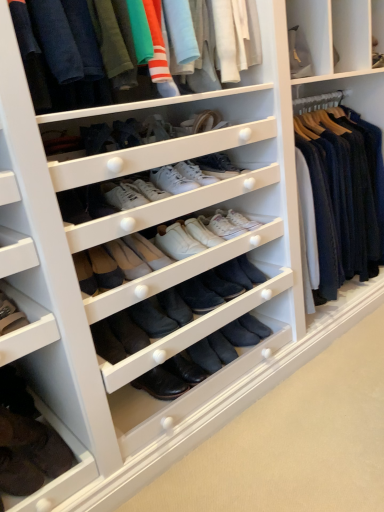
What are the coordinates of `matte cotton t-shirts at upper center` in the screenshot? It's located at (97, 45).

Measure the distance between black suede boot at center, positioned as the fourth shoe in top-to-bottom order, and camera.

They are 1.73 meters apart.

Describe the element at coordinates (222, 347) in the screenshot. This screenshot has height=512, width=384. I see `black suede boot at center, the second shoe from the bottom` at that location.

In order to click on white leather sneakers at center, which is the first shoe in top-to-bottom order in this screenshot , I will do `click(195, 173)`.

Identify the location of leather boot at lower left, which is the second footwear from bottom to top. (10, 315).

Locate an element on the screen. brown leather boots at lower left, the second footwear when ordered from top to bottom is located at coordinates tap(26, 441).

From a real-world perspective, is leather boot at lower left, the 1th footwear when ordered from top to bottom, under matte black boots at center?

No, from a real-world perspective, leather boot at lower left, the 1th footwear when ordered from top to bottom, is not under matte black boots at center.

Considering the positions of objects leather boot at lower left, the 1th footwear when ordered from top to bottom, and matte black boots at center in the image provided, who is in front, leather boot at lower left, the 1th footwear when ordered from top to bottom, or matte black boots at center?

matte black boots at center is in front.

Choose the correct answer: Is leather boot at lower left, which is the second footwear from bottom to top, inside matte black boots at center or outside it?

leather boot at lower left, which is the second footwear from bottom to top, is located beyond the bounds of matte black boots at center.

This screenshot has width=384, height=512. I want to click on drawer below the leather boot at lower left, which is the second footwear from bottom to top (from the image's perspective), so click(x=181, y=351).

Which object is thinner, white leather sneakers at center, the 3th shoe viewed from the top, or matte cotton t-shirts at upper center?

With smaller width is white leather sneakers at center, the 3th shoe viewed from the top.

From the image's perspective, is white leather sneakers at center, the third shoe when ordered from bottom to top, under matte cotton t-shirts at upper center?

Correct, white leather sneakers at center, the third shoe when ordered from bottom to top, appears lower than matte cotton t-shirts at upper center in the image.

Based on the photo, how distant is white leather sneakers at center, the 3th shoe viewed from the top, from matte cotton t-shirts at upper center?

white leather sneakers at center, the 3th shoe viewed from the top, and matte cotton t-shirts at upper center are 18.23 inches apart from each other.

Considering the sizes of objects white leather sneakers at center, which ranks as the second shoe in top-to-bottom order, and brown leather boots at lower left, the second footwear when ordered from top to bottom, in the image provided, who is smaller, white leather sneakers at center, which ranks as the second shoe in top-to-bottom order, or brown leather boots at lower left, the second footwear when ordered from top to bottom,?

white leather sneakers at center, which ranks as the second shoe in top-to-bottom order, is smaller.

From a real-world perspective, is white leather sneakers at center, which ranks as the second shoe in top-to-bottom order, physically below brown leather boots at lower left, the second footwear when ordered from top to bottom?

Incorrect, from a real-world perspective, white leather sneakers at center, which ranks as the second shoe in top-to-bottom order, is higher than brown leather boots at lower left, the second footwear when ordered from top to bottom.

Which is more to the left, white leather sneakers at center, which ranks as the 4th shoe in bottom-to-top order, or brown leather boots at lower left, the first footwear when ordered from bottom to top?

From the viewer's perspective, brown leather boots at lower left, the first footwear when ordered from bottom to top, appears more on the left side.

Is matte black boots at center directly adjacent to white leather sneakers at center, the 3th shoe viewed from the top?

No, matte black boots at center is not beside white leather sneakers at center, the 3th shoe viewed from the top.

From a real-world perspective, which is physically above, matte black boots at center or white leather sneakers at center, the 3th shoe viewed from the top?

white leather sneakers at center, the 3th shoe viewed from the top.

Does matte black boots at center lie in front of white leather sneakers at center, the third shoe when ordered from bottom to top?

Yes, matte black boots at center is closer to the viewer.

Is brown leather boots at lower left, the second footwear when ordered from top to bottom, further to the viewer compared to leather boot at lower left, the 1th footwear when ordered from top to bottom?

No.

Visually, is brown leather boots at lower left, the first footwear when ordered from bottom to top, positioned to the left or to the right of leather boot at lower left, the 1th footwear when ordered from top to bottom?

In the image, brown leather boots at lower left, the first footwear when ordered from bottom to top, appears on the left side of leather boot at lower left, the 1th footwear when ordered from top to bottom.

Considering the sizes of objects brown leather boots at lower left, the second footwear when ordered from top to bottom, and leather boot at lower left, which is the second footwear from bottom to top, in the image provided, who is bigger, brown leather boots at lower left, the second footwear when ordered from top to bottom, or leather boot at lower left, which is the second footwear from bottom to top,?

brown leather boots at lower left, the second footwear when ordered from top to bottom, is bigger.

Which is correct: brown leather boots at lower left, the first footwear when ordered from bottom to top, is inside leather boot at lower left, the 1th footwear when ordered from top to bottom, or outside of it?

brown leather boots at lower left, the first footwear when ordered from bottom to top, cannot be found inside leather boot at lower left, the 1th footwear when ordered from top to bottom.

Based on their sizes in the image, would you say matte cotton t-shirts at upper center is bigger or smaller than brown leather boots at lower left, the second footwear when ordered from top to bottom?

Clearly, matte cotton t-shirts at upper center is larger in size than brown leather boots at lower left, the second footwear when ordered from top to bottom.

From the image's perspective, is matte cotton t-shirts at upper center on top of brown leather boots at lower left, the second footwear when ordered from top to bottom?

Yes.

Does matte cotton t-shirts at upper center come behind brown leather boots at lower left, the second footwear when ordered from top to bottom?

No, it is in front of brown leather boots at lower left, the second footwear when ordered from top to bottom.

Is leather boot at lower left, the 1th footwear when ordered from top to bottom, to the left of white leather sneakers at center, the fifth shoe when ordered from bottom to top, from the viewer's perspective?

Yes.

Is leather boot at lower left, the 1th footwear when ordered from top to bottom, wider or thinner than white leather sneakers at center, which is the first shoe in top-to-bottom order?

In the image, leather boot at lower left, the 1th footwear when ordered from top to bottom, appears to be more narrow than white leather sneakers at center, which is the first shoe in top-to-bottom order.

Considering the sizes of objects leather boot at lower left, the 1th footwear when ordered from top to bottom, and white leather sneakers at center, which is the first shoe in top-to-bottom order, in the image provided, who is smaller, leather boot at lower left, the 1th footwear when ordered from top to bottom, or white leather sneakers at center, which is the first shoe in top-to-bottom order,?

white leather sneakers at center, which is the first shoe in top-to-bottom order, is smaller.

Which is farther, [25,319] or [179,165]?

Point [179,165]

Locate an element on the screen. The height and width of the screenshot is (512, 384). the 2nd footwear positioned above the matte black boots at center (from a real-world perspective) is located at coordinates (10, 315).

This screenshot has width=384, height=512. What are the coordinates of `clothing on the right side of white leather sneakers at center, the third shoe when ordered from bottom to top` in the screenshot? It's located at (97, 45).

Looking at the image, which one is located further to black leather boot at center, which appears as the 1th shoe when ordered from the bottom, brown leather boots at lower left, the second footwear when ordered from top to bottom, or matte black boots at center?

brown leather boots at lower left, the second footwear when ordered from top to bottom, is further to black leather boot at center, which appears as the 1th shoe when ordered from the bottom.

Looking at the image, which one is located further to leather boot at lower left, which is the second footwear from bottom to top, matte black boots at center or brown leather boots at lower left, the second footwear when ordered from top to bottom?

Among the two, matte black boots at center is located further to leather boot at lower left, which is the second footwear from bottom to top.

Based on the photo, which object lies further to the anchor point black suede boot at center, the second shoe from the bottom, leather boot at lower left, which is the second footwear from bottom to top, or black leather boot at center, which appears as the 1th shoe when ordered from the bottom?

Based on the image, leather boot at lower left, which is the second footwear from bottom to top, appears to be further to black suede boot at center, the second shoe from the bottom.

In the scene shown: Which object lies further to the anchor point black leather boot at center, positioned as the 5th shoe in top-to-bottom order, black suede boot at center, positioned as the fourth shoe in top-to-bottom order, or white leather sneakers at center, which ranks as the 4th shoe in bottom-to-top order?

white leather sneakers at center, which ranks as the 4th shoe in bottom-to-top order, is positioned further to the anchor black leather boot at center, positioned as the 5th shoe in top-to-bottom order.

Estimate the real-world distances between objects in this image. Which object is further from black suede boot at center, the second shoe from the bottom, brown leather boots at lower left, the first footwear when ordered from bottom to top, or matte black boots at center?

Based on the image, brown leather boots at lower left, the first footwear when ordered from bottom to top, appears to be further to black suede boot at center, the second shoe from the bottom.

Considering their positions, is matte black boots at center positioned closer to black leather boot at center, which appears as the 1th shoe when ordered from the bottom, than leather boot at lower left, which is the second footwear from bottom to top?

matte black boots at center lies closer to black leather boot at center, which appears as the 1th shoe when ordered from the bottom, than the other object.

When comparing their distances from white leather sneakers at center, the 3th shoe viewed from the top, does black suede boot at center, positioned as the fourth shoe in top-to-bottom order, or white leather sneakers at center, which is the first shoe in top-to-bottom order, seem further?

black suede boot at center, positioned as the fourth shoe in top-to-bottom order, is further to white leather sneakers at center, the 3th shoe viewed from the top.

Estimate the real-world distances between objects in this image. Which object is further from brown leather boots at lower left, the first footwear when ordered from bottom to top, leather boot at lower left, the 1th footwear when ordered from top to bottom, or black leather boot at center, positioned as the 5th shoe in top-to-bottom order?

The object further to brown leather boots at lower left, the first footwear when ordered from bottom to top, is black leather boot at center, positioned as the 5th shoe in top-to-bottom order.

Identify the location of footwear that lies between white leather sneakers at center, which ranks as the second shoe in top-to-bottom order, and black leather boot at center, which appears as the 1th shoe when ordered from the bottom, from top to bottom. This screenshot has height=512, width=384. (10, 315).

This screenshot has width=384, height=512. What are the coordinates of `footwear between matte cotton t-shirts at upper center and black leather boot at center, positioned as the 5th shoe in top-to-bottom order, in the up-down direction` in the screenshot? It's located at (10, 315).

Identify the location of footwear between white leather sneakers at center, the 3th shoe viewed from the top, and brown leather boots at lower left, the second footwear when ordered from top to bottom, from top to bottom. (10, 315).

Where is `footwear located between brown leather boots at lower left, the second footwear when ordered from top to bottom, and matte black boots at center in the left-right direction`? The height and width of the screenshot is (512, 384). footwear located between brown leather boots at lower left, the second footwear when ordered from top to bottom, and matte black boots at center in the left-right direction is located at coordinates (x=10, y=315).